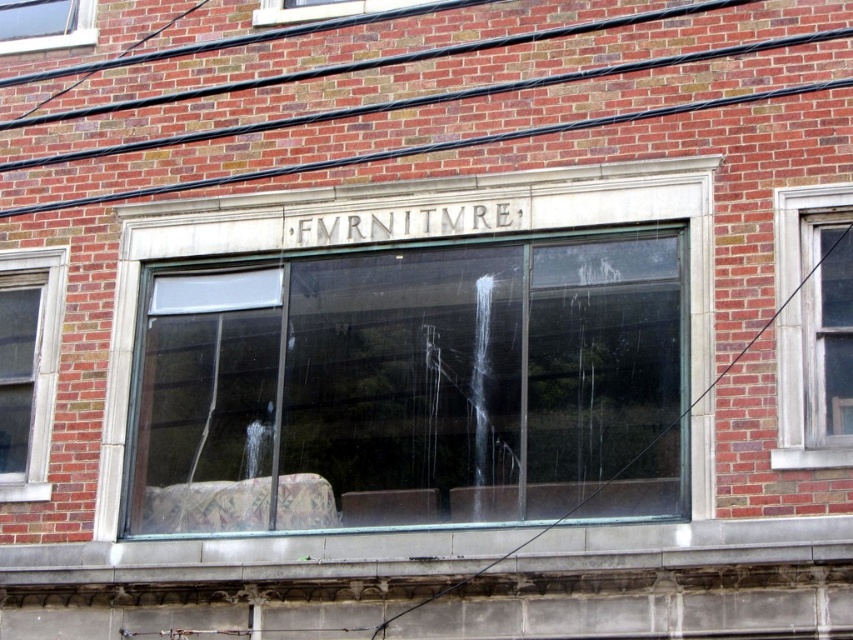
Can you confirm if clear glass furniture at center is bigger than clear glass window at upper left?

Correct, clear glass furniture at center is larger in size than clear glass window at upper left.

What do you see at coordinates (407, 237) in the screenshot? Image resolution: width=853 pixels, height=640 pixels. I see `clear glass furniture at center` at bounding box center [407, 237].

The image size is (853, 640). What are the coordinates of `clear glass furniture at center` in the screenshot? It's located at (407, 237).

Which of these two, clear glass window at center or clear glass window at upper left, stands taller?

clear glass window at center is taller.

Can you confirm if clear glass window at center is thinner than clear glass window at upper left?

Correct, clear glass window at center's width is less than clear glass window at upper left's.

Is point (782, 200) farther from viewer compared to point (42, 0)?

No, (782, 200) is closer to viewer.

Where is `clear glass window at center`? clear glass window at center is located at coordinates (811, 371).

Which is more to the left, clear glass furniture at center or clear glass window at center?

clear glass furniture at center

Who is positioned more to the right, clear glass furniture at center or clear glass window at center?

clear glass window at center

Which is in front, point (242, 234) or point (811, 305)?

Point (811, 305) is in front.

Identify the location of clear glass furniture at center. The height and width of the screenshot is (640, 853). (407, 237).